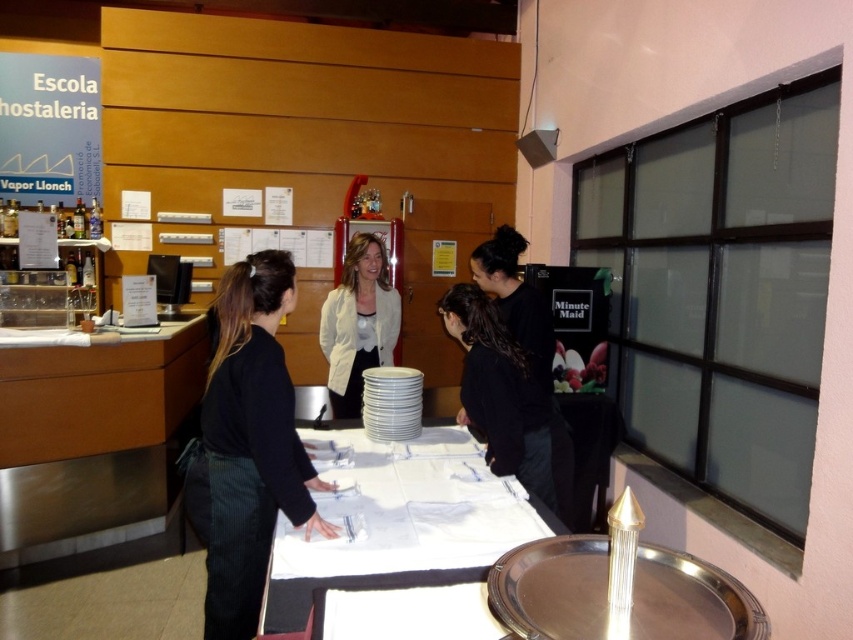
Question: Which object is positioned farthest from the black corduroy pants at center?

Choices:
 (A) black matte jacket at center
 (B) white matte jacket at center
 (C) white cloth at center

Answer: (B)

Question: Which point is farther to the camera?

Choices:
 (A) black corduroy pants at center
 (B) black matte jacket at center
 (C) white cloth at center
 (D) white matte jacket at center

Answer: (D)

Question: Can you confirm if black matte jacket at center is thinner than white matte jacket at center?

Choices:
 (A) yes
 (B) no

Answer: (A)

Question: Which point is farther from the camera taking this photo?

Choices:
 (A) (241, 531)
 (B) (476, 289)

Answer: (B)

Question: Does white cloth at center appear on the left side of black matte jacket at center?

Choices:
 (A) no
 (B) yes

Answer: (B)

Question: In this image, where is white cloth at center located relative to white matte jacket at center?

Choices:
 (A) below
 (B) above

Answer: (A)